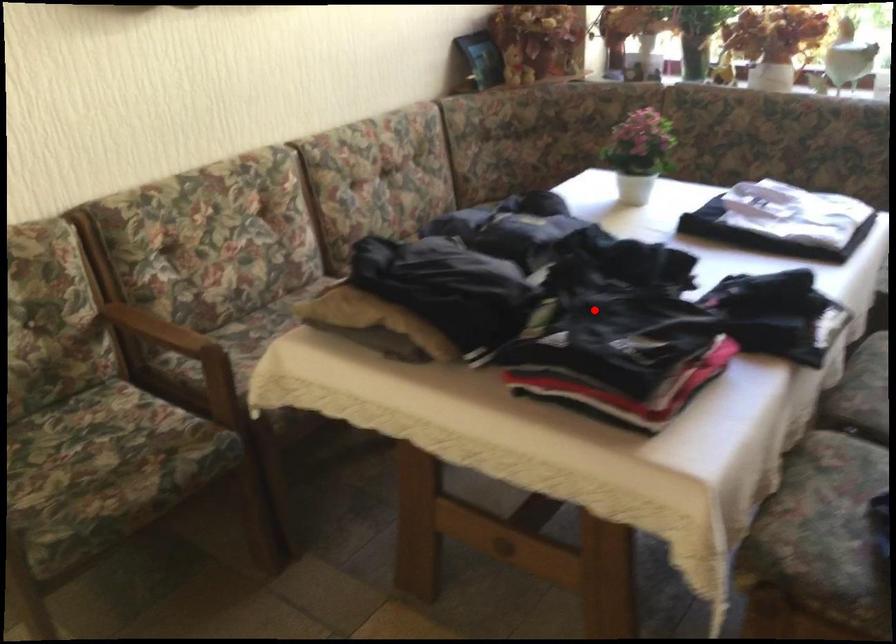
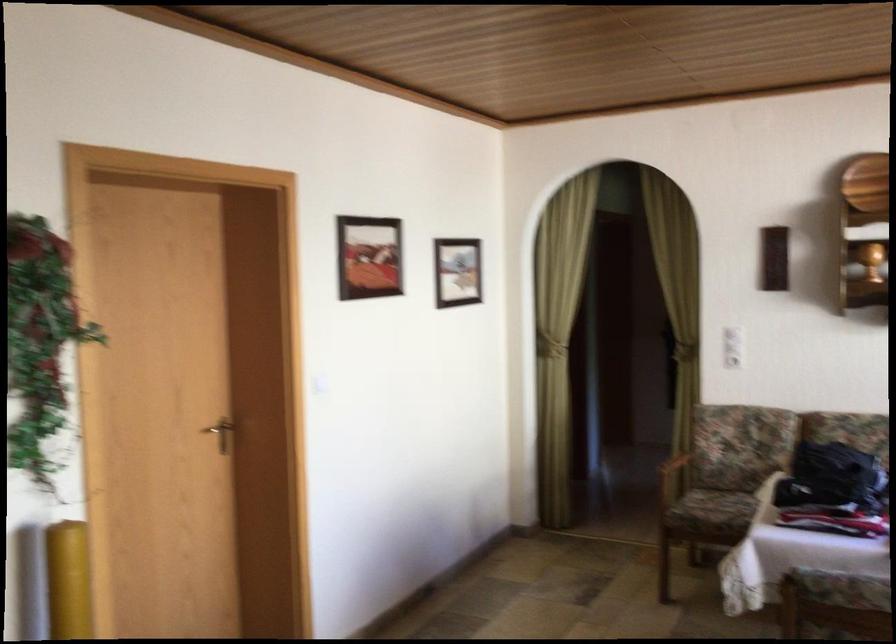
Question: I am providing you with two images of the same scene from different viewpoints. Given a red point in image1, look at the same physical point in image2. Is it:

Choices:
 (A) Closer to the viewpoint
 (B) Farther from the viewpoint

Answer: (B)